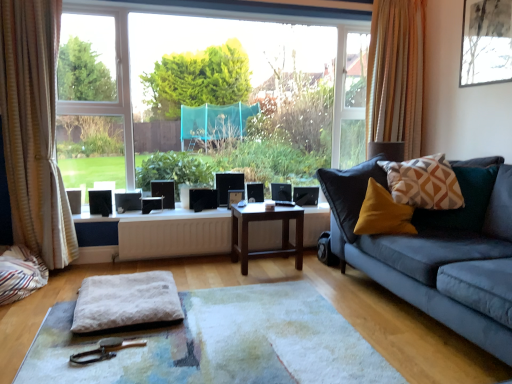
Question: Relative to white striped curtain at left, arranged as the 2th curtain when viewed from the right, is matte black picture frame at upper right, positioned as the first picture frame in front-to-back order, in front or behind?

Choices:
 (A) behind
 (B) front

Answer: (A)

Question: From a real-world perspective, is matte black picture frame at upper right, acting as the 2th picture frame starting from the back, physically located above or below white striped curtain at left, acting as the second curtain starting from the back?

Choices:
 (A) below
 (B) above

Answer: (B)

Question: Which is farther from the geometric-patterned fabric pillow at right?

Choices:
 (A) white striped curtain at left, the first curtain positioned from the front
 (B) matte black picture frame at center, which is the second picture frame from right to left
 (C) white fluffy footrest at center
 (D) white soft cushion at center
 (E) brown wooden table at center

Answer: (A)

Question: Estimate the real-world distances between objects in this image. Which object is closer to the white fluffy footrest at center?

Choices:
 (A) white soft cushion at center
 (B) white matte radiator at center
 (C) matte black picture frame at upper right, acting as the 2th picture frame starting from the back
 (D) transparent glass window at center
 (E) white striped curtain at left, the first curtain positioned from the front

Answer: (A)